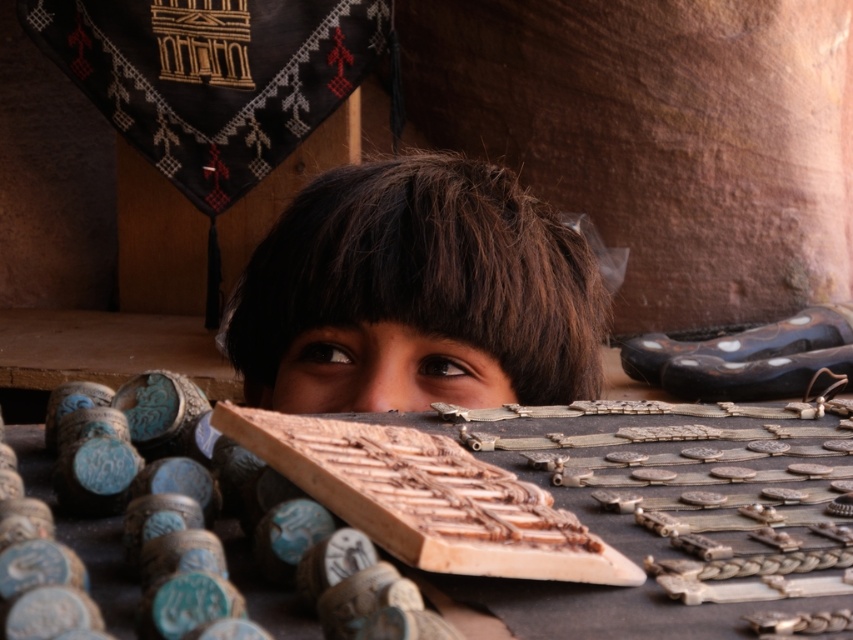
Question: Among these objects, which one is nearest to the camera?

Choices:
 (A) brown matte eye at center
 (B) brown matte face at center
 (C) brown matte eye at upper center

Answer: (B)

Question: Does brown matte hair at center appear on the left side of brown matte face at center?

Choices:
 (A) yes
 (B) no

Answer: (B)

Question: Which object is the closest to the brown matte face at center?

Choices:
 (A) brown matte hair at center
 (B) brown matte eye at center

Answer: (B)

Question: Which point is farther from the camera taking this photo?

Choices:
 (A) (329, 339)
 (B) (480, 355)
 (C) (492, 278)

Answer: (A)

Question: Does brown matte face at center appear on the right side of brown matte eye at upper center?

Choices:
 (A) yes
 (B) no

Answer: (B)

Question: Observing the image, what is the correct spatial positioning of brown matte hair at center in reference to brown matte eye at upper center?

Choices:
 (A) below
 (B) above

Answer: (B)